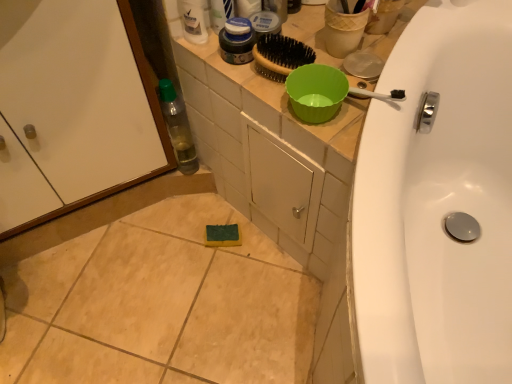
Question: Looking at their shapes, would you say white glossy bottle at upper center is wider or thinner than transparent plastic bottle at left?

Choices:
 (A) wide
 (B) thin

Answer: (B)

Question: Is point (182, 8) closer or farther from the camera than point (172, 89)?

Choices:
 (A) farther
 (B) closer

Answer: (B)

Question: Which of these objects is positioned farthest from the matte plastic mouthwash at upper center?

Choices:
 (A) transparent plastic bottle at left
 (B) white glossy screen door at lower left
 (C) matte blue jar at upper center
 (D) matte plastic bowl at upper center
 (E) white glossy bottle at upper center

Answer: (B)

Question: Estimate the real-world distances between objects in this image. Which object is farther from the white glossy bottle at upper center?

Choices:
 (A) matte plastic mouthwash at upper center
 (B) matte plastic bowl at upper center
 (C) white glossy screen door at lower left
 (D) transparent plastic bottle at left
 (E) matte blue jar at upper center

Answer: (C)